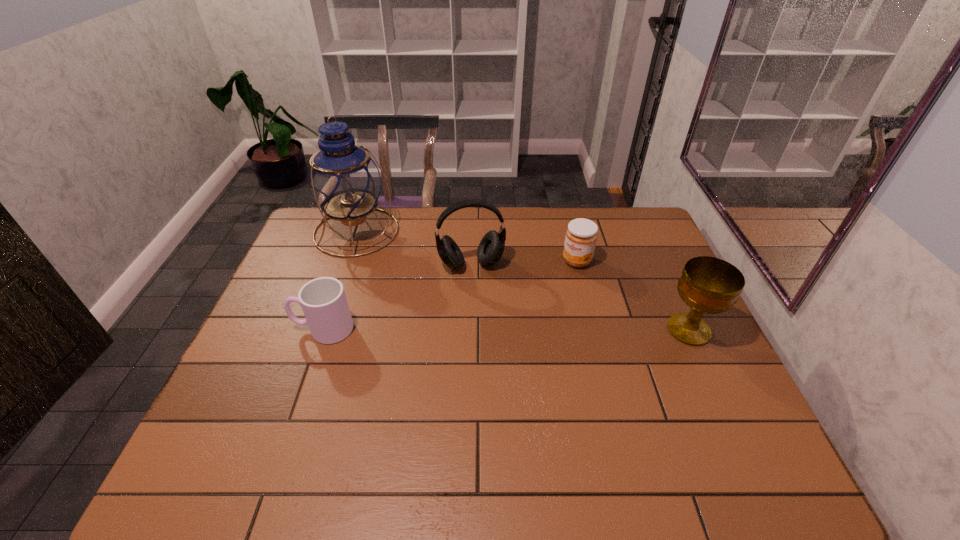
Locate an element on the screen. free space between the third object from left to right and the fourth object from left to right is located at coordinates (524, 262).

At what (x,y) coordinates should I click in order to perform the action: click on free space between the cup and the jam. Please return your answer as a coordinate pair (x, y). The height and width of the screenshot is (540, 960). Looking at the image, I should click on (450, 295).

Identify the location of free spot between the rightmost object and the jam. (633, 295).

Image resolution: width=960 pixels, height=540 pixels. What are the coordinates of `free space between the jam and the third object from right to left` in the screenshot? It's located at (524, 262).

Image resolution: width=960 pixels, height=540 pixels. In order to click on vacant area between the cup and the third object from right to left in this screenshot , I will do click(397, 296).

Image resolution: width=960 pixels, height=540 pixels. Identify the location of vacant space that is in between the rightmost object and the third object from right to left. (580, 297).

Where is `unoccupied area between the lantern and the cup`? Image resolution: width=960 pixels, height=540 pixels. unoccupied area between the lantern and the cup is located at coordinates (340, 280).

This screenshot has height=540, width=960. In order to click on the fourth closest object to the fourth object from left to right in this screenshot , I will do `click(323, 300)`.

What are the coordinates of `the fourth closest object to the jam` in the screenshot? It's located at (323, 300).

At what (x,y) coordinates should I click in order to perform the action: click on vacant point that satisfies the following two spatial constraints: 1. on the back side of the jam; 2. on the right side of the headset. Please return your answer as a coordinate pair (x, y). The image size is (960, 540). Looking at the image, I should click on (471, 261).